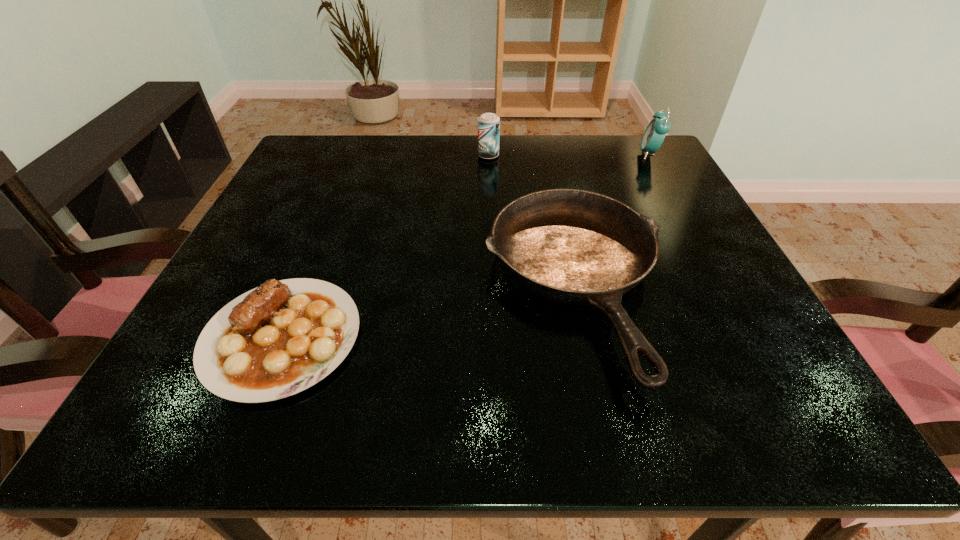
Where is `free spot located 0.310m on the right of the shortest object`? The height and width of the screenshot is (540, 960). free spot located 0.310m on the right of the shortest object is located at coordinates (563, 338).

You are a GUI agent. You are given a task and a screenshot of the screen. Output one action in this format:
    pyautogui.click(x=<x>, y=<y>)
    Task: Click on the alarm clock present at the far edge
    This screenshot has height=540, width=960.
    Given the screenshot: What is the action you would take?
    [654, 135]

This screenshot has width=960, height=540. In order to click on beer can that is positioned at the far edge in this screenshot , I will do `click(488, 123)`.

Where is `frying pan present at the near edge`? frying pan present at the near edge is located at coordinates (576, 247).

The width and height of the screenshot is (960, 540). Identify the location of steak at the near edge. (276, 340).

Where is `object situated at the left edge`? This screenshot has height=540, width=960. object situated at the left edge is located at coordinates (276, 340).

In order to click on alarm clock that is at the right edge in this screenshot , I will do `click(654, 135)`.

Find the location of a particular element. The width and height of the screenshot is (960, 540). frying pan at the right edge is located at coordinates (576, 247).

The image size is (960, 540). I want to click on object that is positioned at the near left corner, so click(x=276, y=340).

At what (x,y) coordinates should I click in order to perform the action: click on object that is positioned at the far right corner. Please return your answer as a coordinate pair (x, y). Looking at the image, I should click on (654, 135).